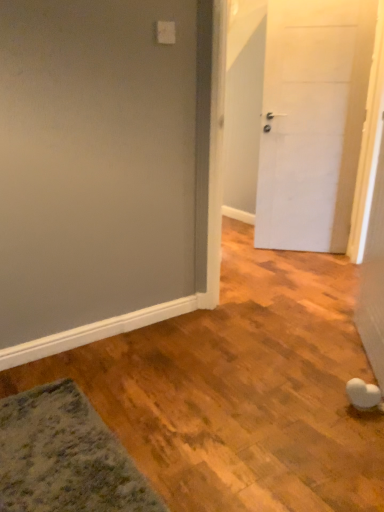
At what (x,y) coordinates should I click in order to perform the action: click on vacant space positioned to the left of white matte door at upper right. Please return your answer as a coordinate pair (x, y). Image resolution: width=384 pixels, height=512 pixels. Looking at the image, I should click on (257, 253).